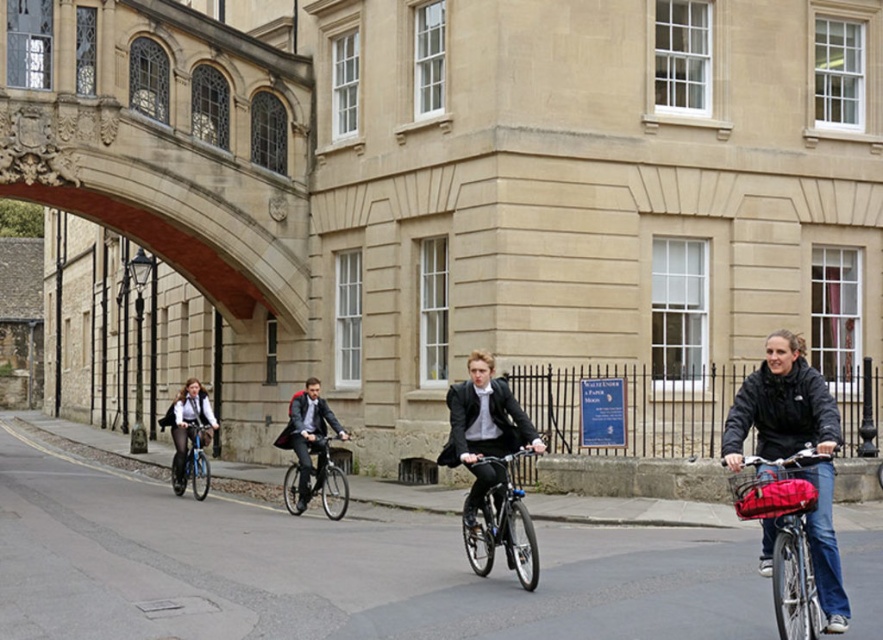
Question: Can you confirm if shiny blue bicycle at center is positioned to the left of matte black jacket at left?

Choices:
 (A) yes
 (B) no

Answer: (B)

Question: Which point is farther from the camera taking this photo?

Choices:
 (A) (802, 628)
 (B) (206, 465)

Answer: (B)

Question: Considering the relative positions of matte black bicycle at right and blue metallic bicycle at left in the image provided, where is matte black bicycle at right located with respect to blue metallic bicycle at left?

Choices:
 (A) above
 (B) below

Answer: (A)

Question: Which is farther from the matte black bicycle at right?

Choices:
 (A) matte black jacket at left
 (B) blue metallic bicycle at left

Answer: (A)

Question: Is matte black bicycle at right below shiny metallic bicycle at center?

Choices:
 (A) yes
 (B) no

Answer: (B)

Question: Considering the real-world distances, which object is farthest from the shiny blue bicycle at center?

Choices:
 (A) matte black jacket at left
 (B) shiny metallic bicycle at center
 (C) blue metallic bicycle at left
 (D) matte black bicycle at right

Answer: (A)